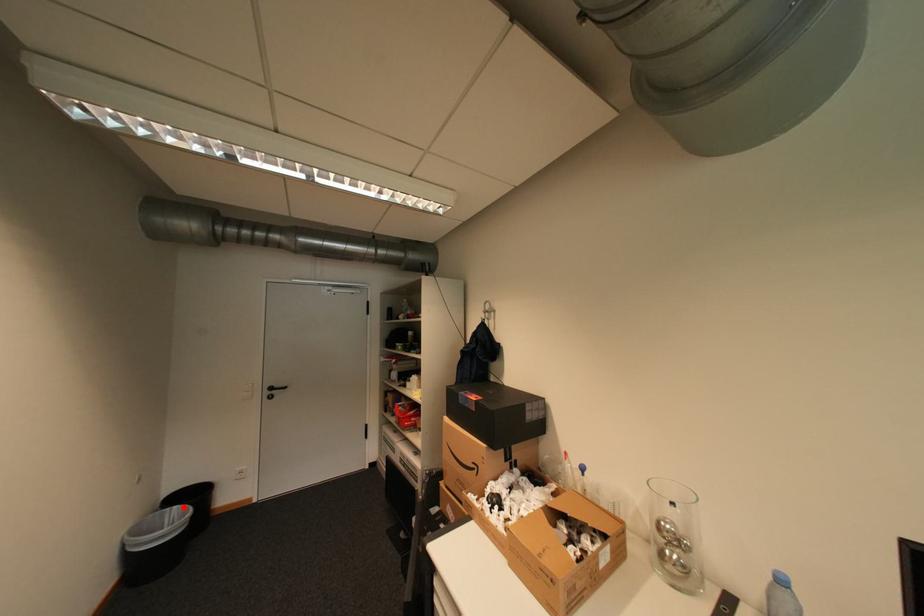
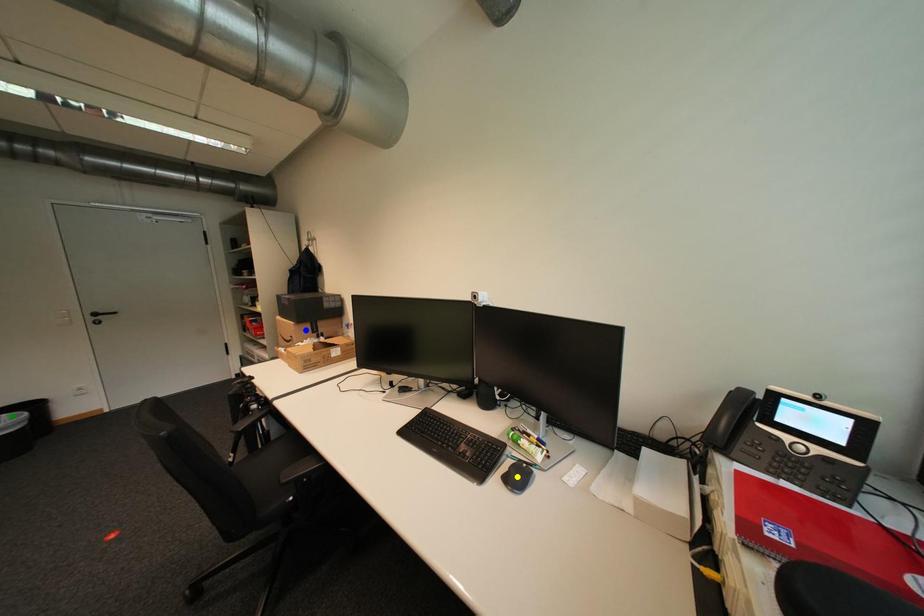
Question: I am providing you with two images of the same scene from different viewpoints. A red point is marked on the first image. You are given multiple points on the second image. Can you choose the point in image 2 that corresponds to the point in image 1?

Choices:
 (A) blue point
 (B) yellow point
 (C) green point

Answer: (C)